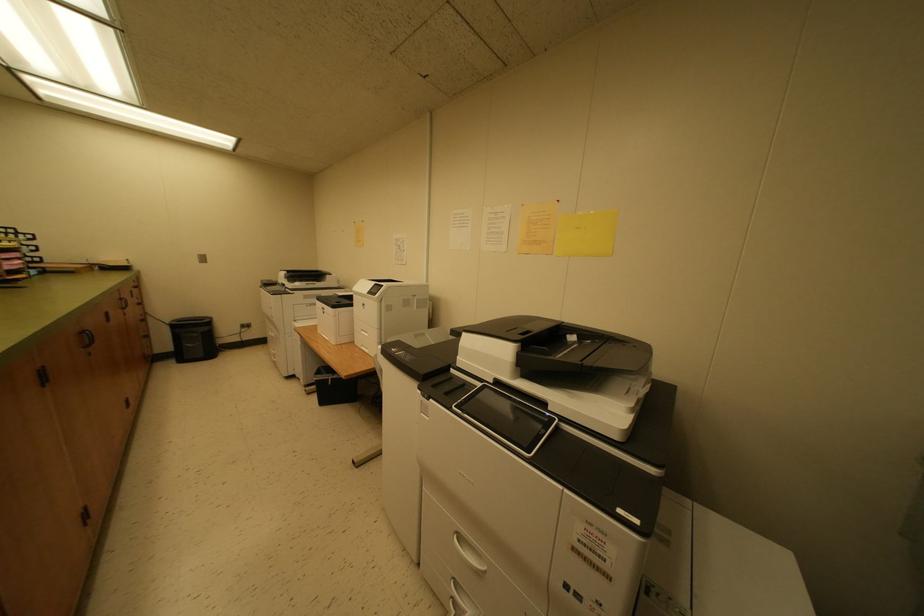
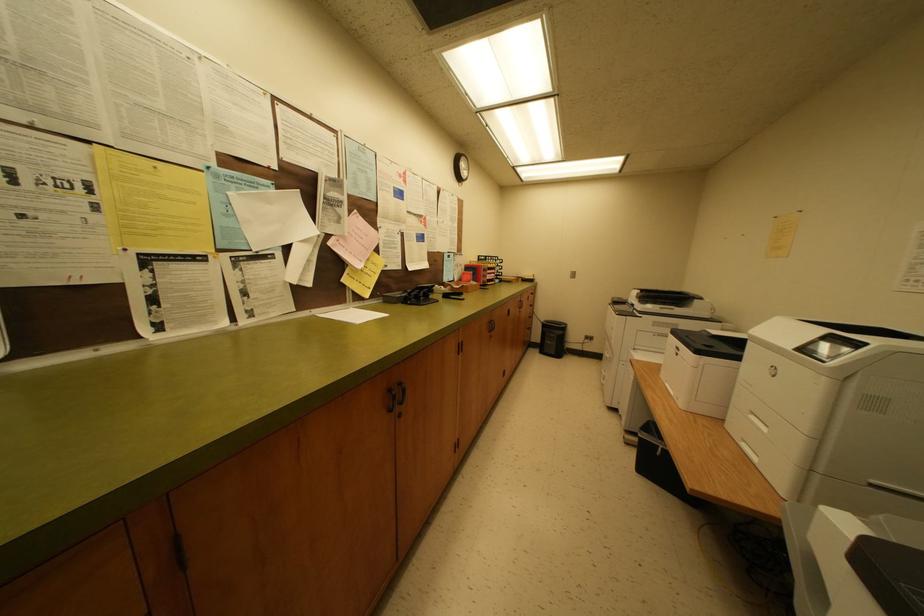
Question: The camera is either moving clockwise (left) or counter-clockwise (right) around the object. The first image is from the beginning of the video and the second image is from the end. Is the camera moving left or right when shooting the video?

Choices:
 (A) Left
 (B) Right

Answer: (B)